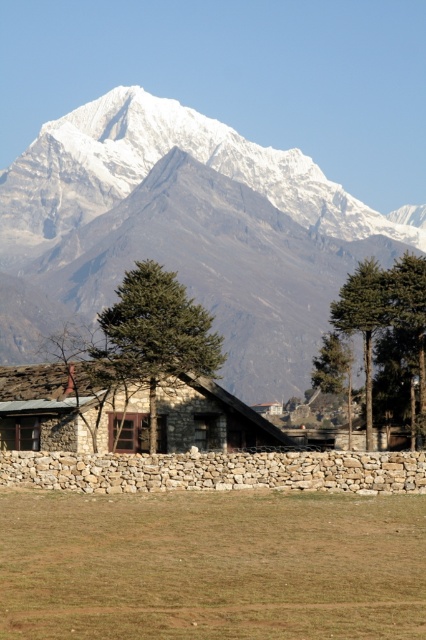
Question: Which point is closer to the camera?

Choices:
 (A) (141, 141)
 (B) (189, 516)

Answer: (B)

Question: Does snowy granite mountain range at upper center have a greater width compared to brown grass at lower center?

Choices:
 (A) yes
 (B) no

Answer: (A)

Question: Which point is farther to the camera?

Choices:
 (A) snowy granite mountain range at upper center
 (B) brown grass at lower center

Answer: (A)

Question: Which point is closer to the camera taking this photo?

Choices:
 (A) (25, 605)
 (B) (385, 257)

Answer: (A)

Question: Can you confirm if brown grass at lower center is positioned above stone textured hut at center?

Choices:
 (A) yes
 (B) no

Answer: (B)

Question: Is snowy granite mountain range at upper center above stone textured hut at center?

Choices:
 (A) yes
 (B) no

Answer: (A)